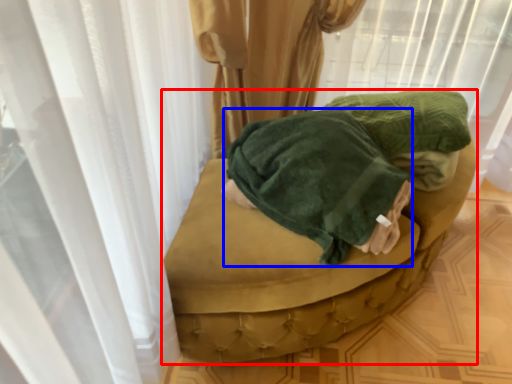
Question: Which object is closer to the camera taking this photo, furniture (highlighted by a red box) or clothing (highlighted by a blue box)?

Choices:
 (A) furniture
 (B) clothing

Answer: (B)